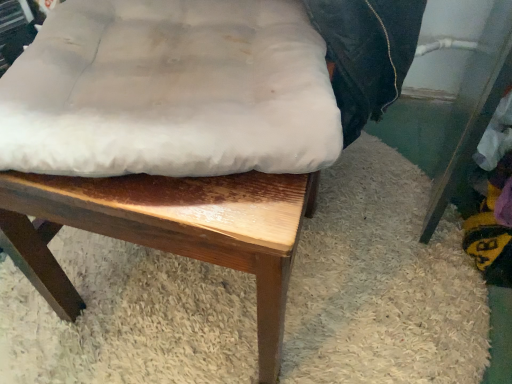
In order to click on vacant space to the right of white fabric cushion at center in this screenshot , I will do `click(405, 259)`.